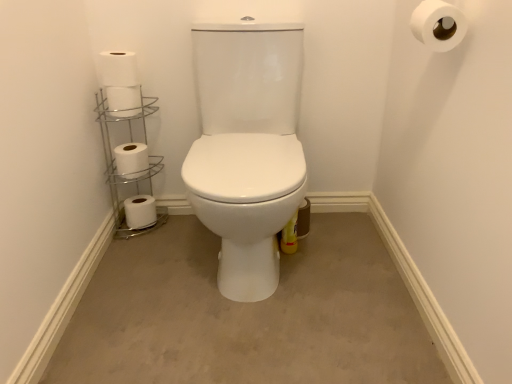
Question: From the image's perspective, relative to white matte toilet paper at upper left, the 1th toilet paper viewed from the top, is beige carpet at center above or below?

Choices:
 (A) above
 (B) below

Answer: (B)

Question: Is beige carpet at center taller or shorter than white matte toilet paper at upper left, positioned as the 5th toilet paper in bottom-to-top order?

Choices:
 (A) tall
 (B) short

Answer: (B)

Question: Which object is the farthest from the beige carpet at center?

Choices:
 (A) white matte toilet paper at left, which is the third toilet paper in top-to-bottom order
 (B) white matte toilet paper at upper right, acting as the 5th toilet paper starting from the back
 (C) white matte toilet paper at left, which is the 4th toilet paper in right-to-left order
 (D) white matte toilet paper at upper left, which is the second toilet paper from front to back
 (E) white matte toilet paper at lower left, the fifth toilet paper when ordered from right to left

Answer: (B)

Question: Which is farther from the white matte toilet paper at left, the fourth toilet paper from the front?

Choices:
 (A) white matte toilet paper at upper left, the 2th toilet paper in the right-to-left sequence
 (B) white matte toilet paper at lower left, which is the 1th toilet paper from bottom to top
 (C) silver/metallic toilet paper holder at left
 (D) white matte toilet paper at upper right, the first toilet paper in the right-to-left sequence
 (E) white matte toilet paper at left, the third toilet paper in the left-to-right sequence

Answer: (D)